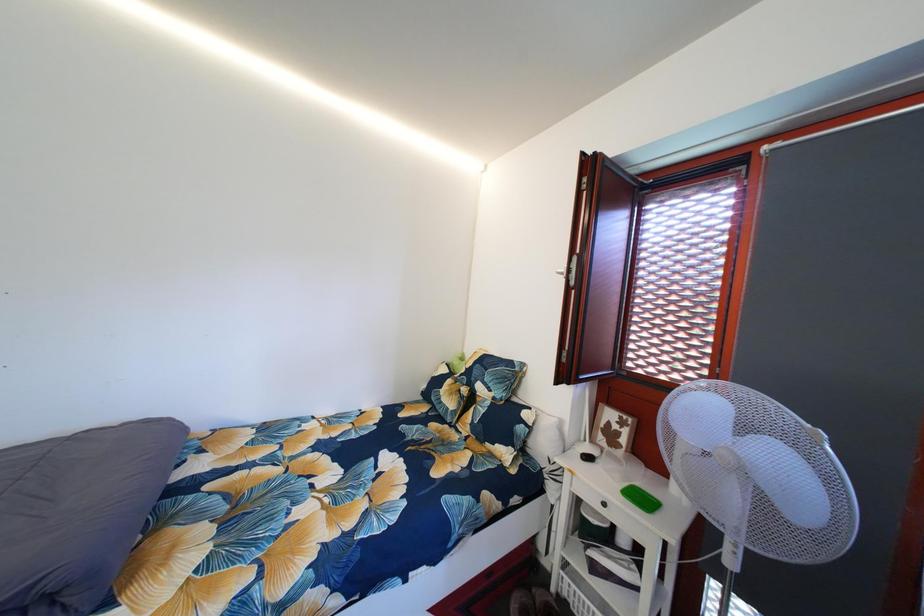
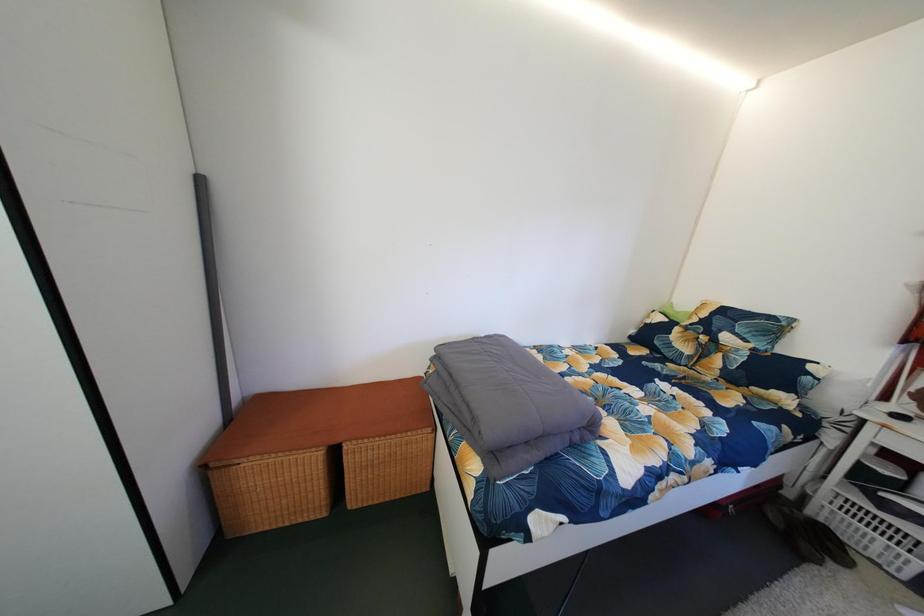
Question: In a continuous first-person perspective shot, in which direction is the camera moving?

Choices:
 (A) Left
 (B) Right
 (C) Forward
 (D) Backward

Answer: (A)